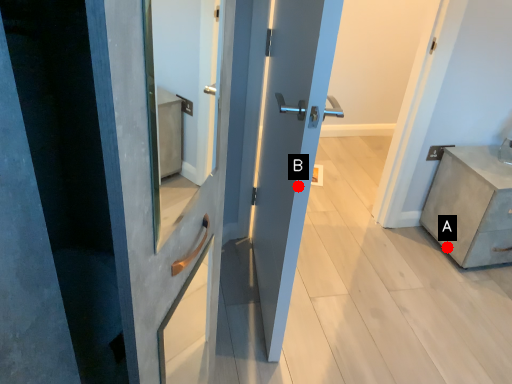
Question: Two points are circled on the image, labeled by A and B beside each circle. Which point appears farthest from the camera in this image?

Choices:
 (A) A is further
 (B) B is further

Answer: (A)